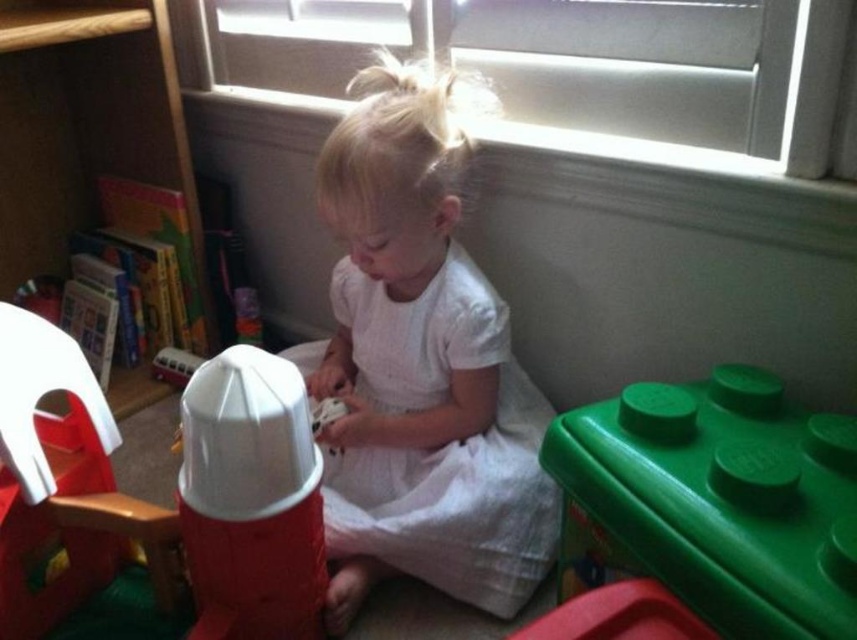
The child is holding a small toy and wants to place it into the green plastic container at lower right. The child can reach 24 inches. Can they place the toy into the container without moving?

The distance between the child and the green plastic container at lower right is 23.48 inches. Since the child can reach 24 inches, they can place the toy into the container without moving.

The child is holding a small toy. They want to place it into the green plastic container at lower right or onto the wooden bookshelf at left. Which object is shorter and therefore safer for the child to reach?

The green plastic container at lower right is not as tall as the wooden bookshelf at left, so it is shorter and safer for the child to reach.